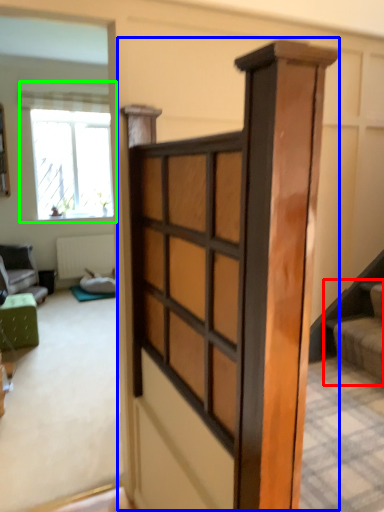
Question: Based on their relative distances, which object is nearer to stairs (highlighted by a red box)? Choose from barn door (highlighted by a blue box) and window (highlighted by a green box).

Choices:
 (A) barn door
 (B) window

Answer: (A)